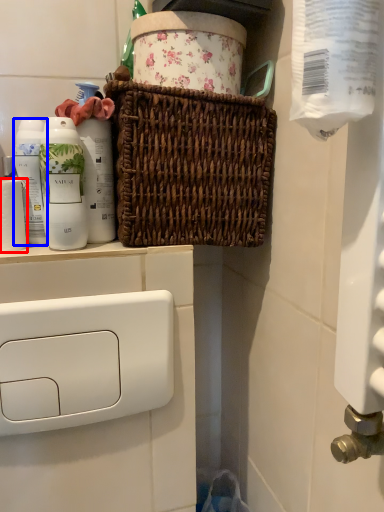
Question: Which object appears closest to the camera in this image, toilet paper (highlighted by a red box) or mouthwash (highlighted by a blue box)?

Choices:
 (A) toilet paper
 (B) mouthwash

Answer: (A)